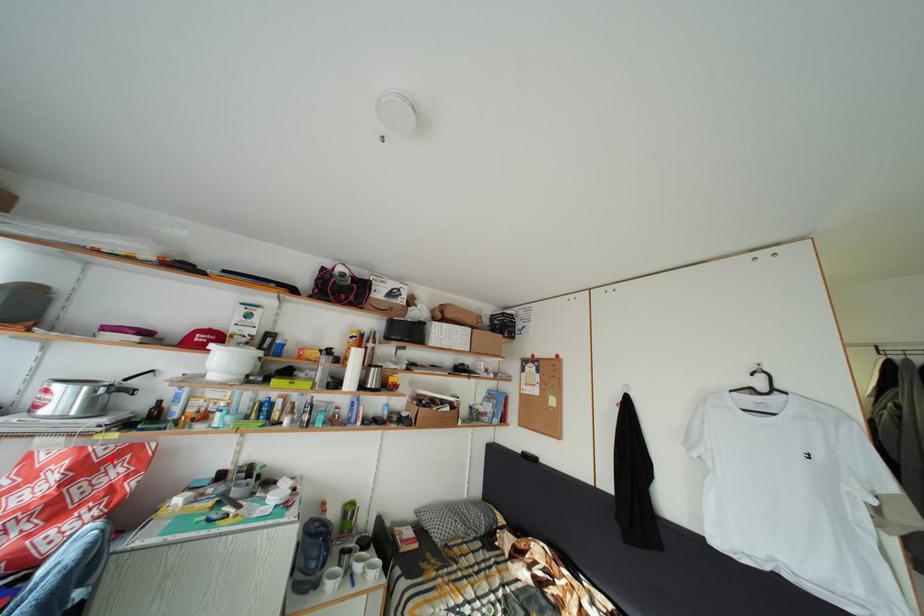
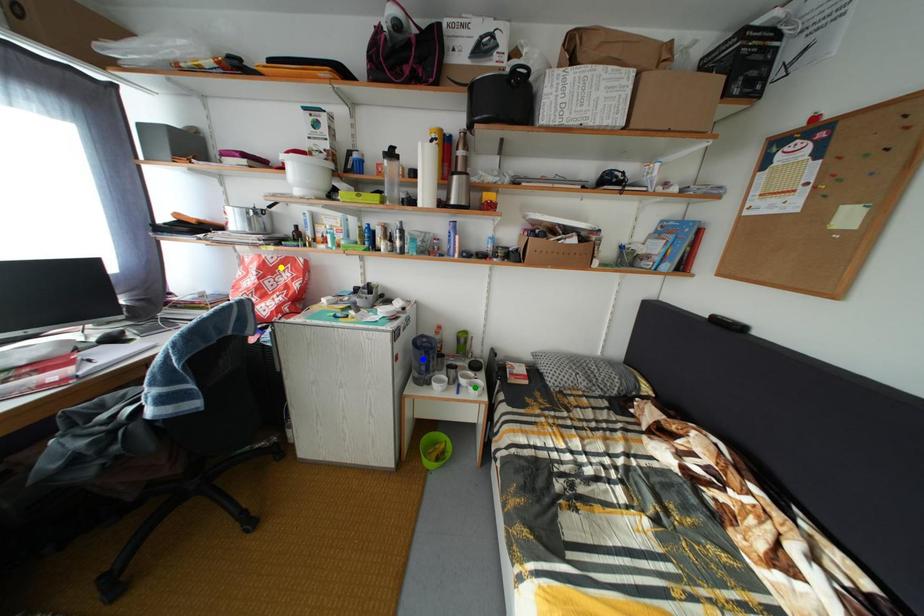
Question: I am providing you with two images of the same scene from different viewpoints. A red point is marked on the first image. You are given multiple points on the second image. Which point in image 2 represents the same 3d spot as the red point in image 1?

Choices:
 (A) green point
 (B) yellow point
 (C) blue point

Answer: (B)